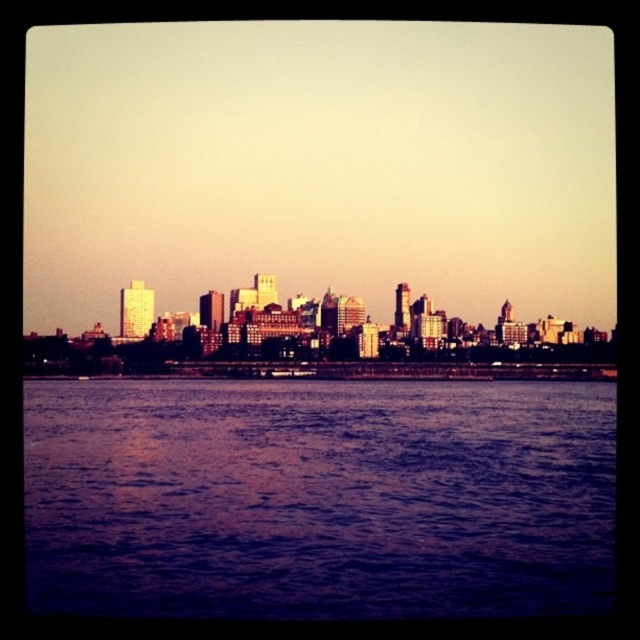
You are a tourist standing on the edge of the purple water at center, looking towards the matte urban skyline at center. Which object is closer to you?

The purple water at center is closer to you because you are standing on it, while the matte urban skyline at center is further away in the distance.

You are a photographer trying to capture the reflection of the matte urban skyline at center in the water. However, there is a metallic silver boat at center in the way. Based on their positions, will the skyline still be visible in the reflection?

The matte urban skyline at center is positioned on the right side of the metallic silver boat at center, so the skyline will still be visible in the reflection as it is not directly blocked by the boat.

You are an architect designing a new observation deck. You want to ensure visitors can see both the purple water at center and the matte urban skyline at center. Based on their positions, which object should be placed closer to the edge of the deck for optimal viewing?

The purple water at center is positioned on the right side of matte urban skyline at center, so to ensure both are visible, the purple water at center should be placed closer to the edge of the deck to allow visitors to view it alongside the skyline.